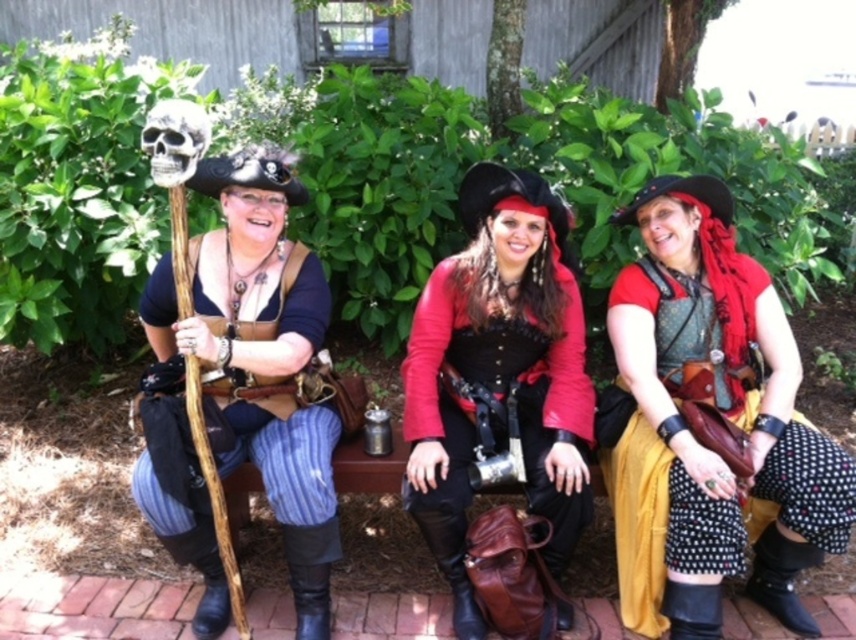
Based on the photo, does shiny red fabric at center have a lesser height compared to gray matte skull at center?

No, shiny red fabric at center is not shorter than gray matte skull at center.

Who is positioned more to the right, shiny red fabric at center or gray matte skull at center?

From the viewer's perspective, shiny red fabric at center appears more on the right side.

Find the location of a particular element. The image size is (856, 640). shiny red fabric at center is located at coordinates (498, 374).

Does matte black vest at center lie behind matte brown leather staff at left?

Yes, it is.

Between matte black vest at center and matte brown leather staff at left, which one has more height?

With more height is matte black vest at center.

Who is more forward, (687, 438) or (328, 470)?

Point (328, 470) is in front.

Image resolution: width=856 pixels, height=640 pixels. I want to click on matte black vest at center, so click(x=709, y=426).

Is shiny red fabric at center thinner than matte brown leather staff at left?

Correct, shiny red fabric at center's width is less than matte brown leather staff at left's.

Is shiny red fabric at center to the left of matte brown leather staff at left from the viewer's perspective?

In fact, shiny red fabric at center is to the right of matte brown leather staff at left.

Is point (405, 492) closer to camera compared to point (314, 515)?

No, (405, 492) is behind (314, 515).

Image resolution: width=856 pixels, height=640 pixels. I want to click on shiny red fabric at center, so click(498, 374).